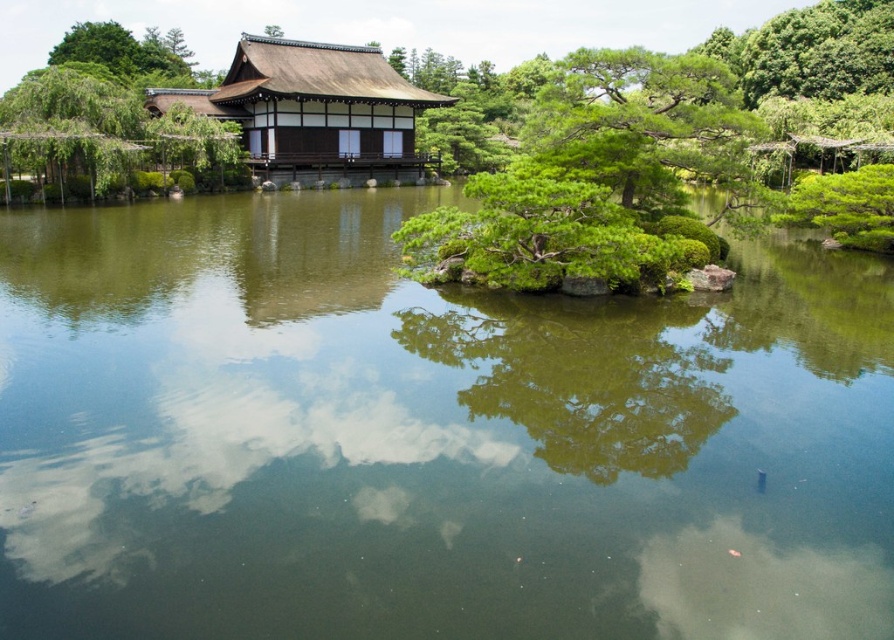
You are a visitor in the Japanese garden and want to take a photo of the green reflective water at center and the green textured pine tree at upper right. Which object appears larger in the photo?

The green textured pine tree at upper right appears larger in the photo because the green reflective water at center has a smaller size compared to it.